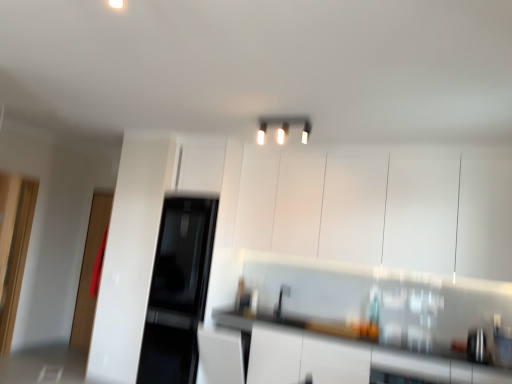
Question: Based on their positions, is transparent glass door at left, the second glass door viewed from the back, located to the left or right of white glossy countertop at lower right?

Choices:
 (A) left
 (B) right

Answer: (A)

Question: Considering the positions of transparent glass door at left, which is counted as the 1th glass door, starting from the front, and white glossy countertop at lower right in the image, is transparent glass door at left, which is counted as the 1th glass door, starting from the front, wider or thinner than white glossy countertop at lower right?

Choices:
 (A) wide
 (B) thin

Answer: (B)

Question: Which is farther from the transparent glass door at left, the 1th glass door from the back?

Choices:
 (A) transparent glass door at left, the second glass door viewed from the back
 (B) black glass refrigerator at center, arranged as the 2th appliance when viewed from the right
 (C) white glossy countertop at lower right
 (D) sleek stainless steel kettle at lower right, marked as the second appliance in a back-to-front arrangement
 (E) white glossy light fixture at upper center

Answer: (D)

Question: Estimate the real-world distances between objects in this image. Which object is farther from the sleek stainless steel kettle at lower right, placed as the 1th appliance when sorted from bottom to top?

Choices:
 (A) transparent glass door at left, the 1th glass door from the back
 (B) transparent glass door at left, the second glass door viewed from the back
 (C) white glossy countertop at lower right
 (D) white glossy light fixture at upper center
 (E) black glass refrigerator at center, the 1th appliance positioned from the left

Answer: (A)